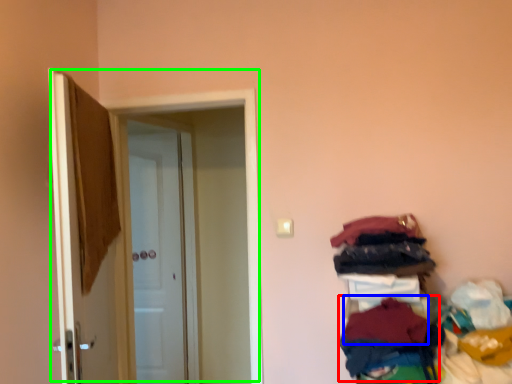
Question: Based on their relative distances, which object is farther from clothing (highlighted by a red box)? Choose from clothing (highlighted by a blue box) and door (highlighted by a green box).

Choices:
 (A) clothing
 (B) door

Answer: (B)